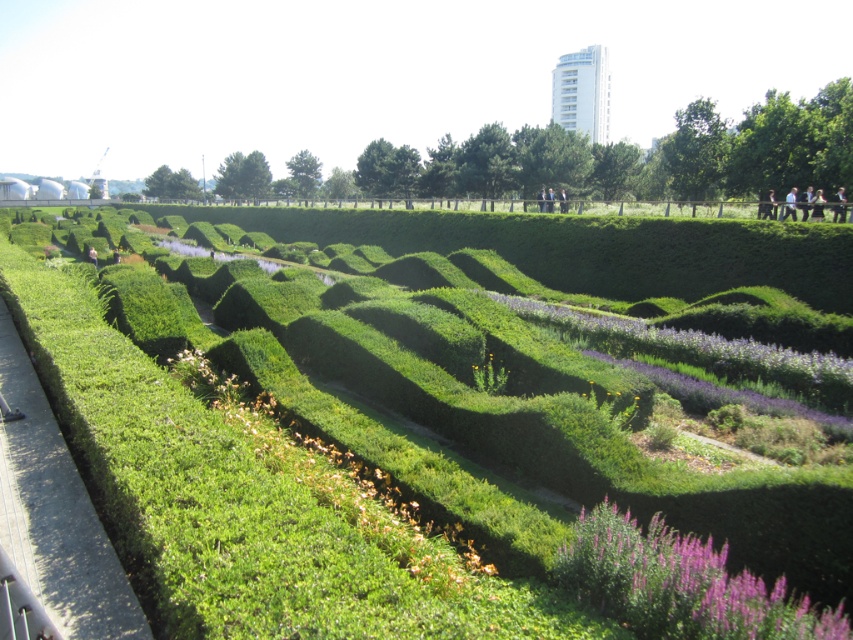
Question: Observing the image, what is the correct spatial positioning of green hedge maze at center in reference to light blue shirt at upper right?

Choices:
 (A) left
 (B) right

Answer: (A)

Question: Does purple soft-textured flowers at center appear on the right side of light blue shirt at upper right?

Choices:
 (A) no
 (B) yes

Answer: (A)

Question: Which point is farther to the camera?

Choices:
 (A) purple fuzzy flower at lower right
 (B) green grassy hedge at center
 (C) light blue shirt at upper right
 (D) green hedge maze at center

Answer: (C)

Question: Which point is farther from the camera taking this photo?

Choices:
 (A) (416, 566)
 (B) (828, 520)
 (C) (666, 550)

Answer: (B)

Question: Does purple soft-textured flowers at center appear on the right side of light blue shirt at upper right?

Choices:
 (A) yes
 (B) no

Answer: (B)

Question: Among these points, which one is farthest from the camera?

Choices:
 (A) (339, 492)
 (B) (815, 636)
 (C) (790, 195)

Answer: (C)